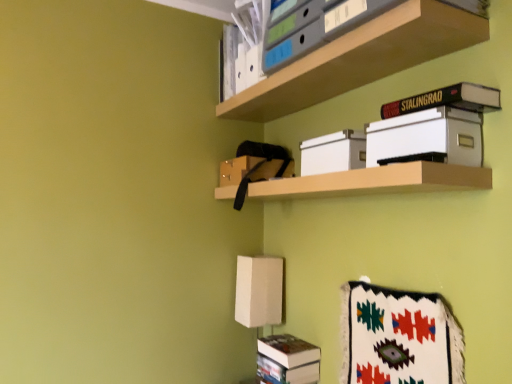
Question: Is wooden shelf at center, the 1th shelf from the bottom, at the back of hardcover black book at upper right?

Choices:
 (A) yes
 (B) no

Answer: (B)

Question: Considering the relative sizes of hardcover black book at upper right and wooden shelf at center, the 1th shelf from the bottom, in the image provided, is hardcover black book at upper right bigger than wooden shelf at center, the 1th shelf from the bottom,?

Choices:
 (A) yes
 (B) no

Answer: (B)

Question: Can you see hardcover black book at upper right touching wooden shelf at center, the 1th shelf from the bottom?

Choices:
 (A) no
 (B) yes

Answer: (A)

Question: From the image's perspective, is hardcover black book at upper right located beneath wooden shelf at center, which ranks as the 2th shelf in top-to-bottom order?

Choices:
 (A) no
 (B) yes

Answer: (A)

Question: Does hardcover black book at upper right have a greater width compared to wooden shelf at center, which ranks as the 2th shelf in top-to-bottom order?

Choices:
 (A) no
 (B) yes

Answer: (A)

Question: From the image's perspective, is hardcover black book at upper right located above or below matte plastic folders at upper center, which is the 1th shelf in top-to-bottom order?

Choices:
 (A) below
 (B) above

Answer: (A)

Question: Relative to matte plastic folders at upper center, which is the 1th shelf in top-to-bottom order, is hardcover black book at upper right in front or behind?

Choices:
 (A) front
 (B) behind

Answer: (B)

Question: In terms of width, does hardcover black book at upper right look wider or thinner when compared to matte plastic folders at upper center, which ranks as the 2th shelf in bottom-to-top order?

Choices:
 (A) thin
 (B) wide

Answer: (A)

Question: Do you think hardcover black book at upper right is within matte plastic folders at upper center, which ranks as the 2th shelf in bottom-to-top order, or outside of it?

Choices:
 (A) inside
 (B) outside

Answer: (B)

Question: In terms of width, does hardcover black book at upper right look wider or thinner when compared to wooden shelf at center, which ranks as the 2th shelf in top-to-bottom order?

Choices:
 (A) wide
 (B) thin

Answer: (B)

Question: Based on their positions, is hardcover black book at upper right located to the left or right of wooden shelf at center, which ranks as the 2th shelf in top-to-bottom order?

Choices:
 (A) right
 (B) left

Answer: (A)

Question: Would you say hardcover black book at upper right is inside or outside wooden shelf at center, the 1th shelf from the bottom?

Choices:
 (A) inside
 (B) outside

Answer: (B)

Question: From a real-world perspective, is hardcover black book at upper right above or below wooden shelf at center, the 1th shelf from the bottom?

Choices:
 (A) above
 (B) below

Answer: (A)

Question: Is beige fabric lampshade at lower center to the left or to the right of white cardboard box at center in the image?

Choices:
 (A) right
 (B) left

Answer: (B)

Question: Looking at their shapes, would you say beige fabric lampshade at lower center is wider or thinner than white cardboard box at center?

Choices:
 (A) wide
 (B) thin

Answer: (A)